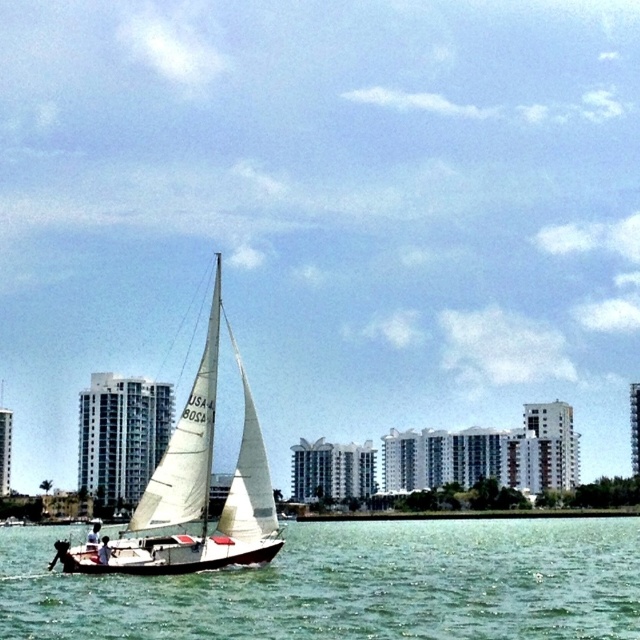
You are a photographer taking a picture of the green water at center and the white sailboat at center. Which object is located to the right of the other?

The green water at center is positioned on the right side of white sailboat at center.